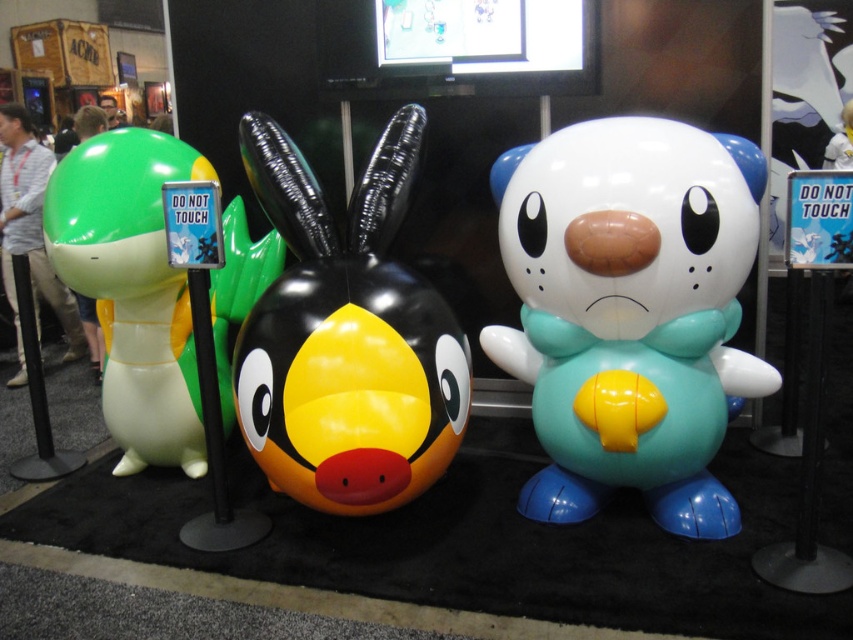
Question: Does teal rubber plush at center have a lesser width compared to glossy rubber duck at center?

Choices:
 (A) yes
 (B) no

Answer: (B)

Question: Which point is closer to the camera?

Choices:
 (A) teal rubber plush at center
 (B) glossy rubber duck at center
 (C) green rubber turtle at left

Answer: (A)

Question: Is teal rubber plush at center positioned at the back of glossy rubber duck at center?

Choices:
 (A) no
 (B) yes

Answer: (A)

Question: Is teal rubber plush at center above glossy rubber duck at center?

Choices:
 (A) yes
 (B) no

Answer: (B)

Question: Estimate the real-world distances between objects in this image. Which object is closer to the glossy rubber duck at center?

Choices:
 (A) teal rubber plush at center
 (B) green rubber turtle at left

Answer: (A)

Question: Estimate the real-world distances between objects in this image. Which object is farther from the glossy rubber duck at center?

Choices:
 (A) teal rubber plush at center
 (B) green rubber turtle at left

Answer: (B)